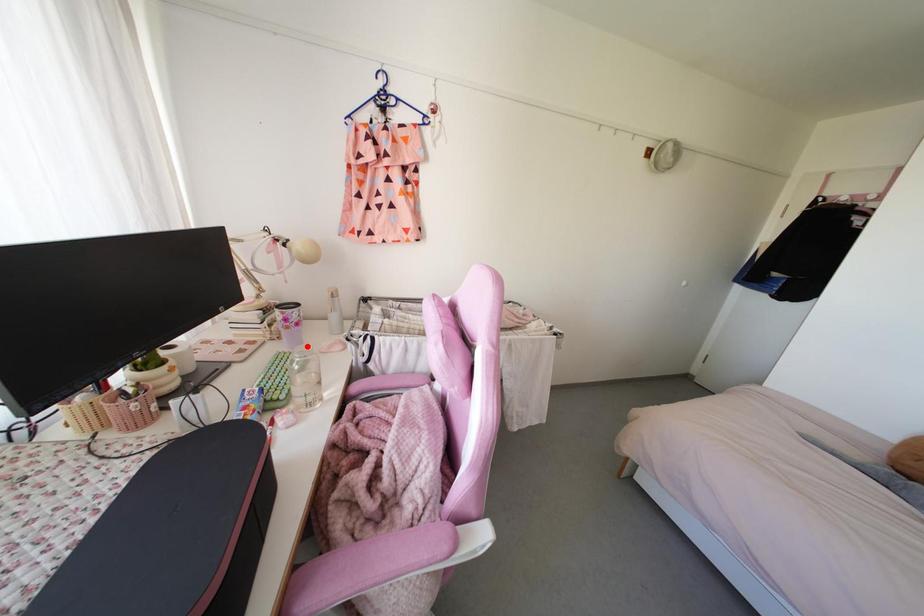
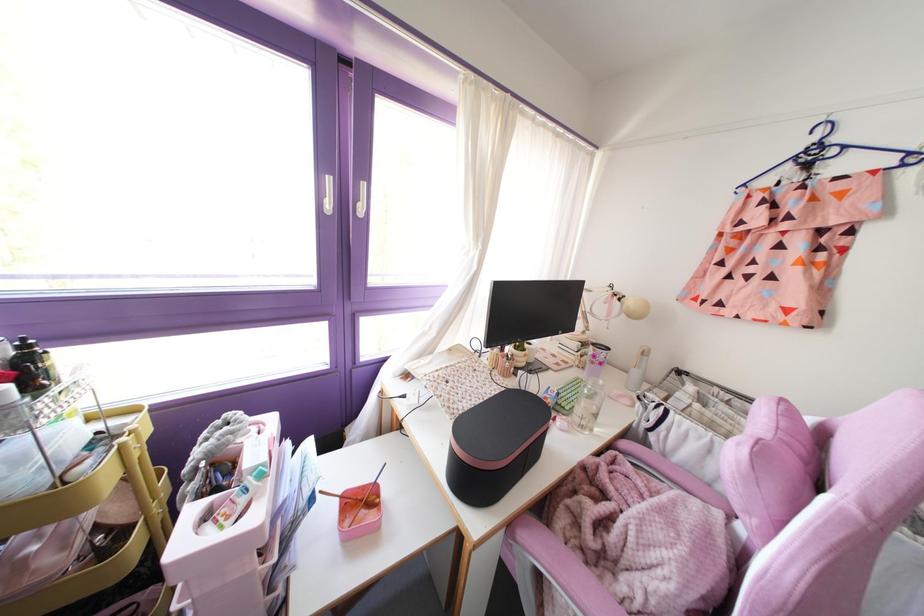
Question: I am providing you with two images of the same scene from different viewpoints. A red point is marked on the first image. At the location where the point appears in image 1, is it still visible in image 2?

Choices:
 (A) Yes
 (B) No

Answer: (A)